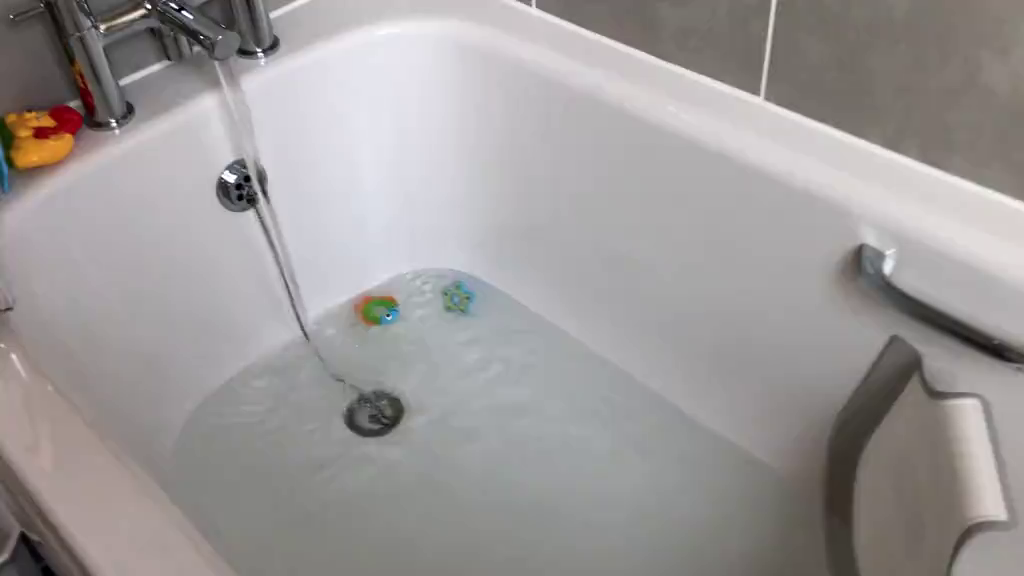
The height and width of the screenshot is (576, 1024). What are the coordinates of `toys with yellow and red colors` in the screenshot? It's located at (38, 139).